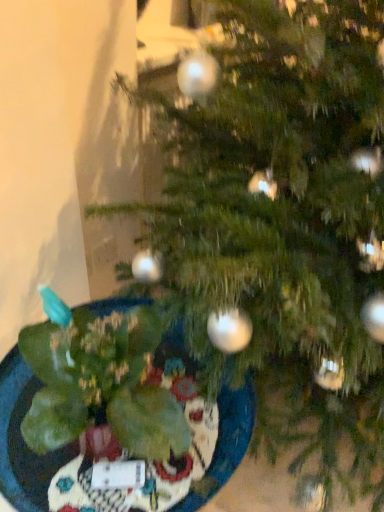
The image size is (384, 512). What do you see at coordinates (233, 429) in the screenshot? I see `green matte glass plate at lower left` at bounding box center [233, 429].

Image resolution: width=384 pixels, height=512 pixels. Find the location of `green matte glass plate at lower left`. green matte glass plate at lower left is located at coordinates (233, 429).

At what (x,y) coordinates should I click in order to perform the action: click on green matte glass plate at lower left. Please return your answer as a coordinate pair (x, y). This screenshot has width=384, height=512. Looking at the image, I should click on (233, 429).